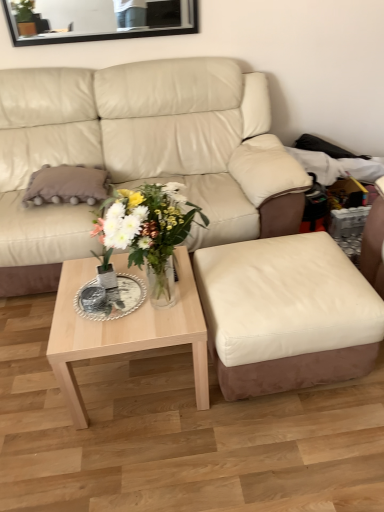
Identify the location of free area in between leather ottoman at center and light wood/texture coffee table at center. (177, 413).